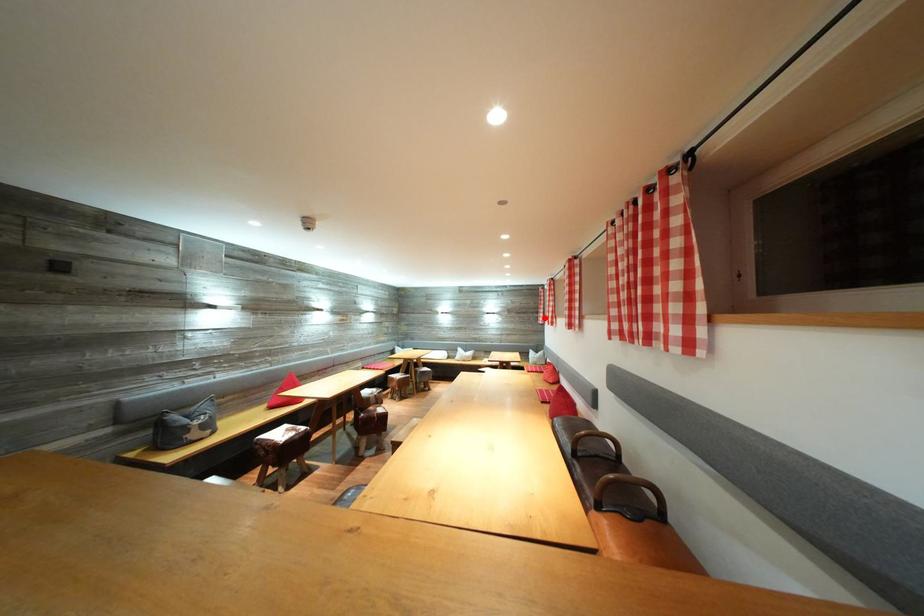
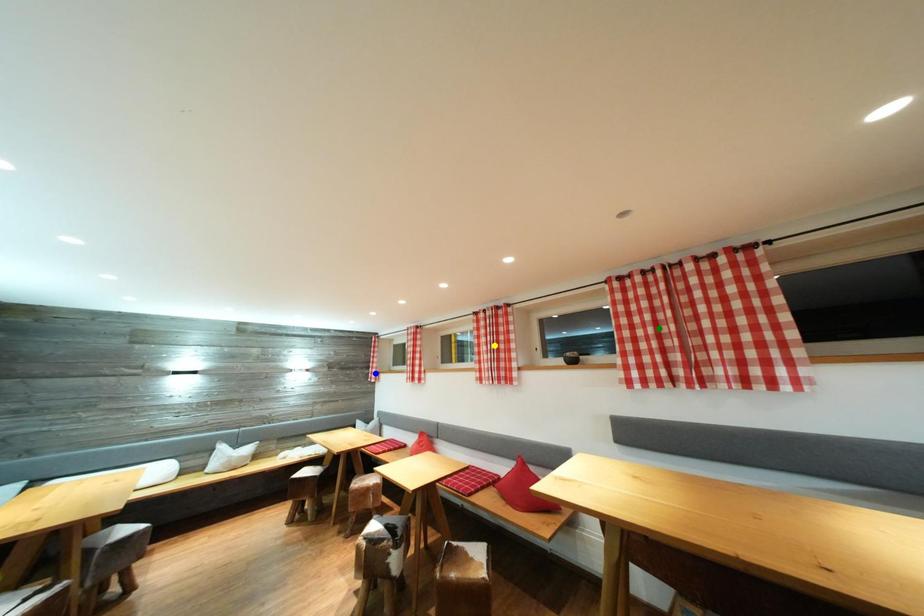
Question: I am providing you with two images of the same scene from different viewpoints. A red point is marked on the first image. You are given multiple points on the second image. Which point in image 2 represents the same 3d spot as the red point in image 1?

Choices:
 (A) green point
 (B) blue point
 (C) yellow point

Answer: (B)